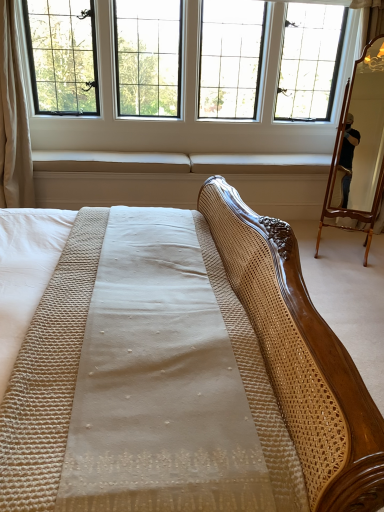
Question: Considering the relative sizes of clear glass window at upper center and wooden mirror at right in the image provided, is clear glass window at upper center wider than wooden mirror at right?

Choices:
 (A) yes
 (B) no

Answer: (A)

Question: Is wooden mirror at right a part of clear glass window at upper center?

Choices:
 (A) no
 (B) yes

Answer: (A)

Question: Is clear glass window at upper center facing towards wooden mirror at right?

Choices:
 (A) yes
 (B) no

Answer: (A)

Question: Does clear glass window at upper center appear on the right side of wooden mirror at right?

Choices:
 (A) yes
 (B) no

Answer: (B)

Question: Does clear glass window at upper center have a larger size compared to wooden mirror at right?

Choices:
 (A) no
 (B) yes

Answer: (B)

Question: Does clear glass window at upper center have a lesser height compared to wooden mirror at right?

Choices:
 (A) yes
 (B) no

Answer: (A)

Question: Is wooden mirror at right to the right of white fabric curtain at left from the viewer's perspective?

Choices:
 (A) no
 (B) yes

Answer: (B)

Question: From the image's perspective, is wooden mirror at right over white fabric curtain at left?

Choices:
 (A) no
 (B) yes

Answer: (A)

Question: Is wooden mirror at right looking in the opposite direction of white fabric curtain at left?

Choices:
 (A) yes
 (B) no

Answer: (B)

Question: Is wooden mirror at right to the left of white fabric curtain at left from the viewer's perspective?

Choices:
 (A) yes
 (B) no

Answer: (B)

Question: Does wooden mirror at right have a greater width compared to white fabric curtain at left?

Choices:
 (A) no
 (B) yes

Answer: (A)

Question: Can you confirm if wooden mirror at right is smaller than white fabric curtain at left?

Choices:
 (A) no
 (B) yes

Answer: (B)

Question: Is clear glass window at upper center smaller than white fabric curtain at left?

Choices:
 (A) yes
 (B) no

Answer: (B)